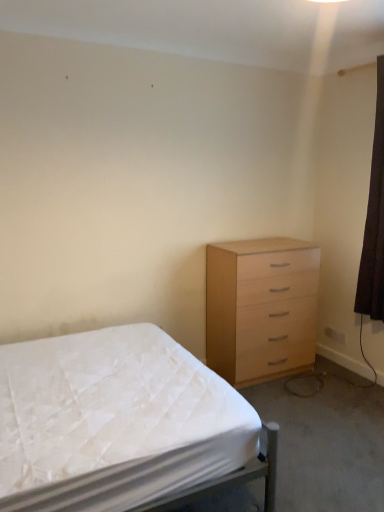
Question: Considering the relative sizes of brown fabric curtain at right and white fabric bed at lower left in the image provided, is brown fabric curtain at right thinner than white fabric bed at lower left?

Choices:
 (A) yes
 (B) no

Answer: (A)

Question: From a real-world perspective, is brown fabric curtain at right over white fabric bed at lower left?

Choices:
 (A) no
 (B) yes

Answer: (B)

Question: Is white fabric bed at lower left a part of brown fabric curtain at right?

Choices:
 (A) no
 (B) yes

Answer: (A)

Question: From the image's perspective, is brown fabric curtain at right on white fabric bed at lower left?

Choices:
 (A) yes
 (B) no

Answer: (A)

Question: Is brown fabric curtain at right positioned far away from white fabric bed at lower left?

Choices:
 (A) yes
 (B) no

Answer: (A)

Question: Is brown fabric curtain at right touching white fabric bed at lower left?

Choices:
 (A) no
 (B) yes

Answer: (A)

Question: Are white fabric bed at lower left and light wood chest of drawers at right located far from each other?

Choices:
 (A) no
 (B) yes

Answer: (B)

Question: From a real-world perspective, is white fabric bed at lower left positioned over light wood chest of drawers at right based on gravity?

Choices:
 (A) no
 (B) yes

Answer: (A)

Question: Is light wood chest of drawers at right inside white fabric bed at lower left?

Choices:
 (A) no
 (B) yes

Answer: (A)

Question: Is white fabric bed at lower left outside of light wood chest of drawers at right?

Choices:
 (A) yes
 (B) no

Answer: (A)

Question: From a real-world perspective, is white fabric bed at lower left below light wood chest of drawers at right?

Choices:
 (A) yes
 (B) no

Answer: (A)

Question: Is white fabric bed at lower left next to light wood chest of drawers at right and touching it?

Choices:
 (A) yes
 (B) no

Answer: (B)

Question: Can you confirm if light wood chest of drawers at right is shorter than white fabric bed at lower left?

Choices:
 (A) yes
 (B) no

Answer: (B)